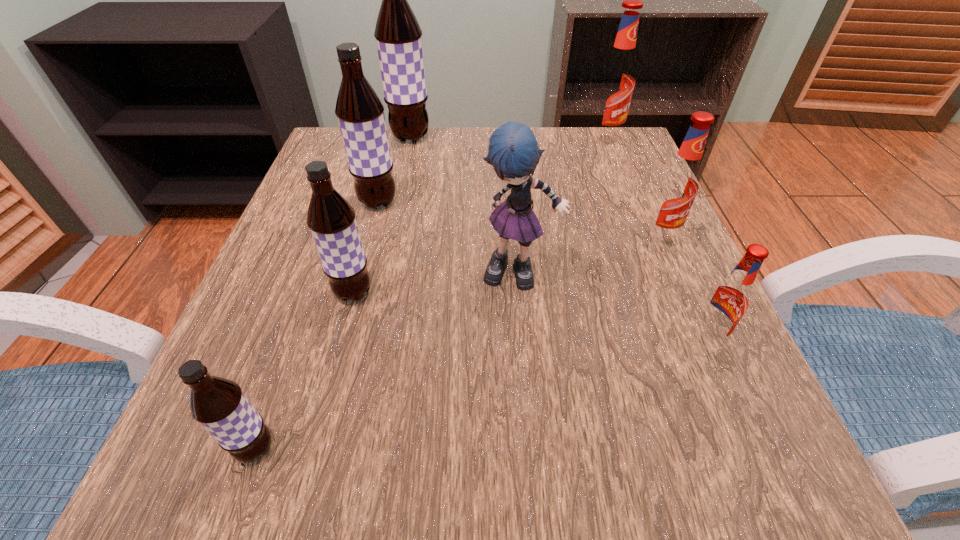
Where is `vacant area that lies between the fifth farthest root beer and the fifth object from left to right`? The image size is (960, 540). vacant area that lies between the fifth farthest root beer and the fifth object from left to right is located at coordinates (437, 284).

Choose which object is the second nearest neighbor to the blue rag doll. Please provide its 2D coordinates. Your answer should be formatted as a tuple, i.e. [(x, y)], where the tuple contains the x and y coordinates of a point satisfying the conditions above.

[(331, 219)]

Image resolution: width=960 pixels, height=540 pixels. What are the coordinates of `object that is the second closest to the fourth nearest root beer` in the screenshot? It's located at (728, 301).

Where is `root beer that can be found as the fifth closest to the farthest brown root beer`? The height and width of the screenshot is (540, 960). root beer that can be found as the fifth closest to the farthest brown root beer is located at coordinates (728, 301).

What are the coordinates of `root beer object that ranks as the fourth closest to the biggest red root beer` in the screenshot? It's located at (728, 301).

Locate which brown root beer is the closest to the blue rag doll. Please provide its 2D coordinates. Your answer should be formatted as a tuple, i.e. [(x, y)], where the tuple contains the x and y coordinates of a point satisfying the conditions above.

[(331, 219)]

Locate an element on the screen. the closest brown root beer to the farthest red root beer is located at coordinates (398, 34).

At what (x,y) coordinates should I click in order to perform the action: click on the third closest red root beer to the biggest brown root beer. Please return your answer as a coordinate pair (x, y). This screenshot has width=960, height=540. Looking at the image, I should click on (728, 301).

This screenshot has width=960, height=540. Identify the location of red root beer identified as the second closest to the second smallest red root beer. (616, 80).

Identify the location of vacant area that satisfies the following two spatial constraints: 1. on the front side of the biggest red root beer; 2. on the right side of the fourth farthest object. The width and height of the screenshot is (960, 540). (640, 237).